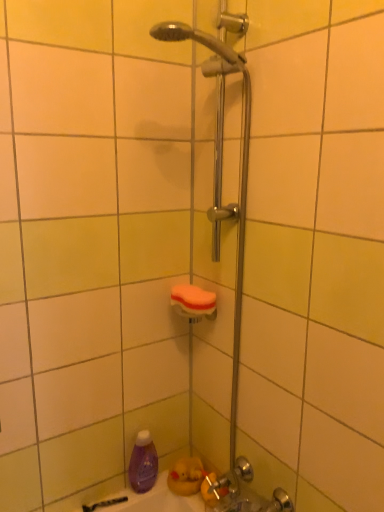
Measure the distance between orange sponge at center and camera.

orange sponge at center is 1.19 meters away from camera.

What is the approximate width of orange sponge at center?

It is 12.31 centimeters.

Describe the element at coordinates (193, 301) in the screenshot. I see `orange sponge at center` at that location.

Locate an element on the screen. This screenshot has width=384, height=512. orange sponge at center is located at coordinates (193, 301).

Find the location of a particular element. purple matte bottle at lower left is located at coordinates (x=143, y=463).

Image resolution: width=384 pixels, height=512 pixels. What do you see at coordinates (143, 463) in the screenshot?
I see `purple matte bottle at lower left` at bounding box center [143, 463].

Locate an element on the screen. The height and width of the screenshot is (512, 384). orange sponge at center is located at coordinates (193, 301).

Visually, is purple matte bottle at lower left positioned to the left or to the right of orange sponge at center?

purple matte bottle at lower left is to the left of orange sponge at center.

Consider the image. Is purple matte bottle at lower left behind orange sponge at center?

Yes, the depth of purple matte bottle at lower left is greater than that of orange sponge at center.

Is point (143, 444) farther from camera compared to point (184, 293)?

Yes, point (143, 444) is behind point (184, 293).

From the image's perspective, relative to orange sponge at center, is purple matte bottle at lower left above or below?

Clearly, from the image's perspective, purple matte bottle at lower left is below orange sponge at center.

From a real-world perspective, which object stands above the other?

orange sponge at center is physically above.

Is purple matte bottle at lower left wider or thinner than orange sponge at center?

purple matte bottle at lower left is thinner than orange sponge at center.

Which of these two, purple matte bottle at lower left or orange sponge at center, stands taller?

purple matte bottle at lower left.

In terms of size, does purple matte bottle at lower left appear bigger or smaller than orange sponge at center?

In the image, purple matte bottle at lower left appears to be larger than orange sponge at center.

Could orange sponge at center be considered to be inside purple matte bottle at lower left?

Actually, orange sponge at center is outside purple matte bottle at lower left.

Are purple matte bottle at lower left and orange sponge at center beside each other?

No.

Is purple matte bottle at lower left turned away from orange sponge at center?

No, purple matte bottle at lower left's orientation is not away from orange sponge at center.

The height and width of the screenshot is (512, 384). Identify the location of cleaning product below the orange sponge at center (from a real-world perspective). (143, 463).

From the picture: Does orange sponge at center appear on the left side of purple matte bottle at lower left?

In fact, orange sponge at center is to the right of purple matte bottle at lower left.

Is the depth of orange sponge at center greater than that of purple matte bottle at lower left?

That is False.

Does point (213, 295) come farther from viewer compared to point (147, 431)?

No, (213, 295) is closer to viewer.

From the image's perspective, which one is positioned higher, orange sponge at center or purple matte bottle at lower left?

From the image's view, orange sponge at center is above.

From a real-world perspective, is orange sponge at center positioned above or below purple matte bottle at lower left?

In terms of real-world spatial position, orange sponge at center is above purple matte bottle at lower left.

Which of these two, orange sponge at center or purple matte bottle at lower left, is wider?

With larger width is orange sponge at center.

Does orange sponge at center have a lesser height compared to purple matte bottle at lower left?

Yes, orange sponge at center is shorter than purple matte bottle at lower left.

Is orange sponge at center bigger than purple matte bottle at lower left?

No.

Based on the photo, can we say orange sponge at center lies outside purple matte bottle at lower left?

Yes.

Does orange sponge at center touch purple matte bottle at lower left?

They are not placed beside each other.

Is orange sponge at center oriented away from purple matte bottle at lower left?

orange sponge at center does not have its back to purple matte bottle at lower left.

Can you tell me how much orange sponge at center and purple matte bottle at lower left differ in facing direction?

They differ by 89.6 degrees in their facing directions.

Identify the location of cleaning product on the left of orange sponge at center. (143, 463).

The height and width of the screenshot is (512, 384). In order to click on towel bar that appears above the purple matte bottle at lower left (from the image's perspective) in this screenshot , I will do `click(193, 301)`.

Where is `towel bar on the right side of purple matte bottle at lower left`? The image size is (384, 512). towel bar on the right side of purple matte bottle at lower left is located at coordinates (193, 301).